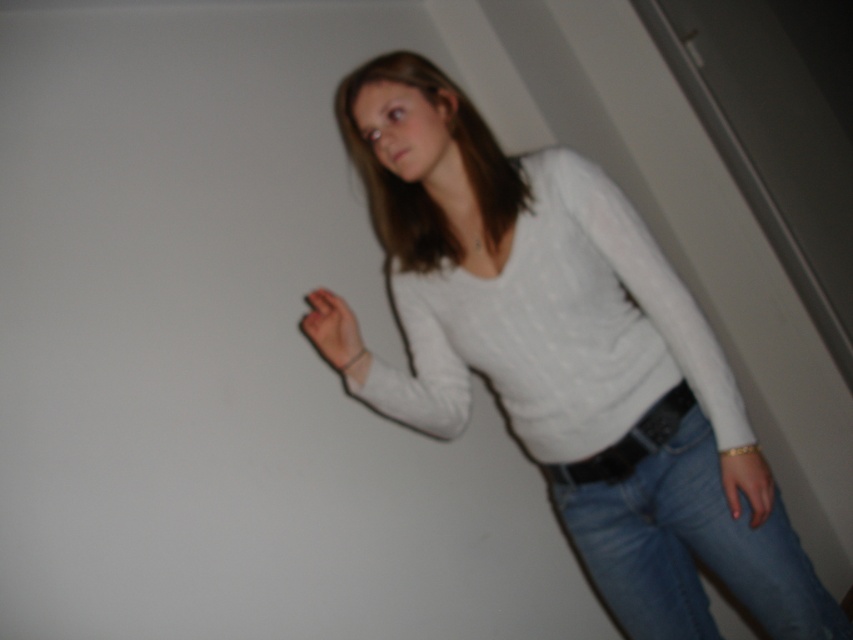
You are a fashion designer analyzing the outfit of the person in the image. You need to determine the spatial relationship between the white knitted sweater at center and the black leather belt at center. Which one is positioned higher on the body?

The white knitted sweater at center is above the black leather belt at center, so the sweater is positioned higher on the body.

You are a fashion designer trying to create a new outfit. You have the white knitted sweater at center and the blue denim jeans at lower right. Based on their sizes, which one would you choose to adjust first if you want to ensure they are proportionally balanced in the final design?

The white knitted sweater at center is much taller than the blue denim jeans at lower right, so you should adjust the white knitted sweater at center first to reduce its height and achieve a proportional balance with the blue denim jeans at lower right.

You are a fashion designer trying to create a new outfit. You have the white knitted sweater at center and the black leather belt at center. Which item would you choose if you want to emphasize the size contrast between clothing items in your design?

The white knitted sweater at center is bigger than the black leather belt at center, so choosing both items would emphasize the size contrast between them in the design.